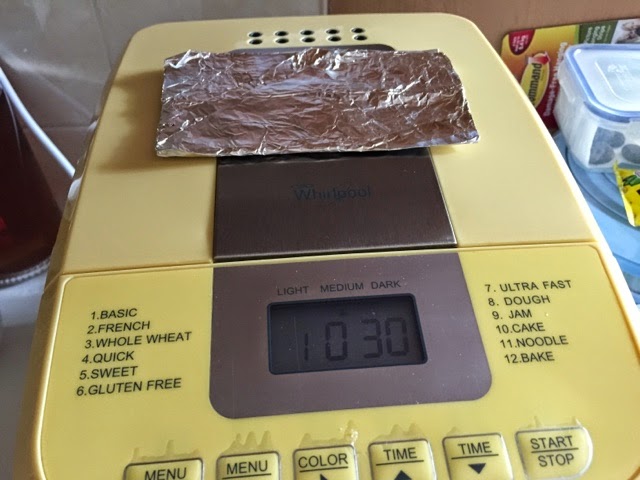
Locate an element on the screen. Image resolution: width=640 pixels, height=480 pixels. vent area is located at coordinates (260, 33), (282, 25), (304, 25), (322, 28), (352, 31).